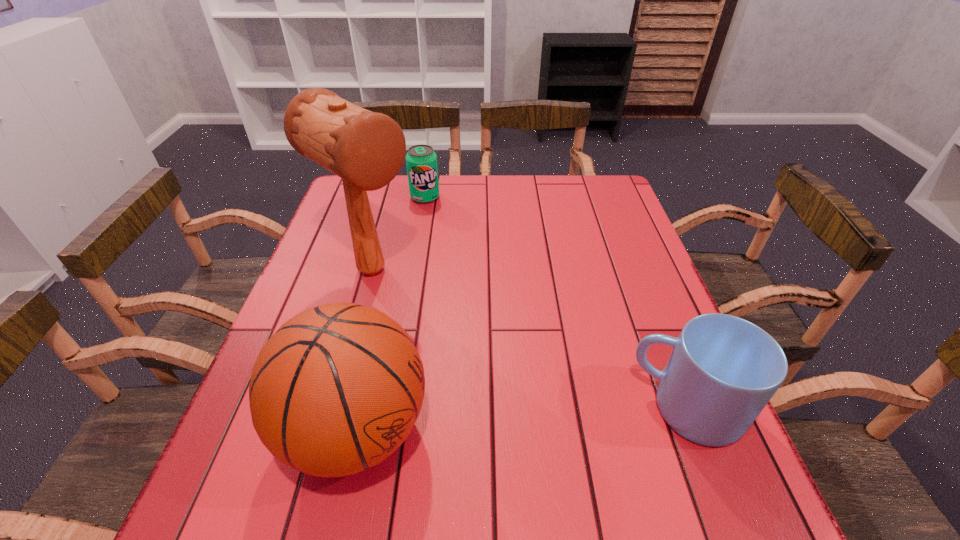
This screenshot has width=960, height=540. Identify the location of object located at the near right corner. (723, 370).

Where is `free region at the far edge of the desktop`? The image size is (960, 540). free region at the far edge of the desktop is located at coordinates (527, 185).

Identify the location of vacant space at the left edge. The image size is (960, 540). (347, 245).

At what (x,y) coordinates should I click in order to perform the action: click on free space at the right edge of the desktop. Please return your answer as a coordinate pair (x, y). This screenshot has width=960, height=540. Looking at the image, I should click on (590, 259).

In the image, there is a desktop. Identify the location of vacant area at the far left corner. (384, 187).

Locate an element on the screen. vacant space at the far right corner is located at coordinates (584, 196).

Locate an element on the screen. vacant region at the near right corner of the desktop is located at coordinates (689, 469).

At what (x,y) coordinates should I click in order to perform the action: click on vacant area that lies between the tallest object and the farthest object. Please return your answer as a coordinate pair (x, y). The width and height of the screenshot is (960, 540). Looking at the image, I should click on (398, 234).

Locate an element on the screen. This screenshot has width=960, height=540. free space between the mallet and the farthest object is located at coordinates (398, 234).

Identify the location of blank region between the second tallest object and the rightmost object. (522, 420).